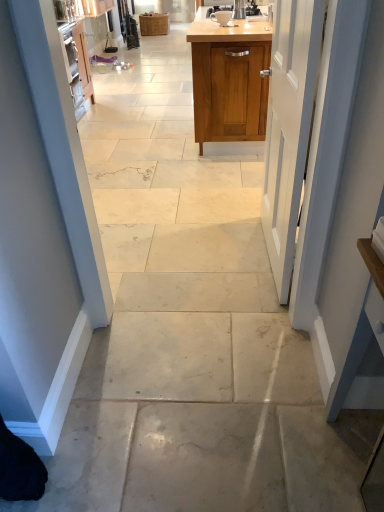
The width and height of the screenshot is (384, 512). Identify the location of free point below white painted wood door at center (from a real-world perspective). (263, 250).